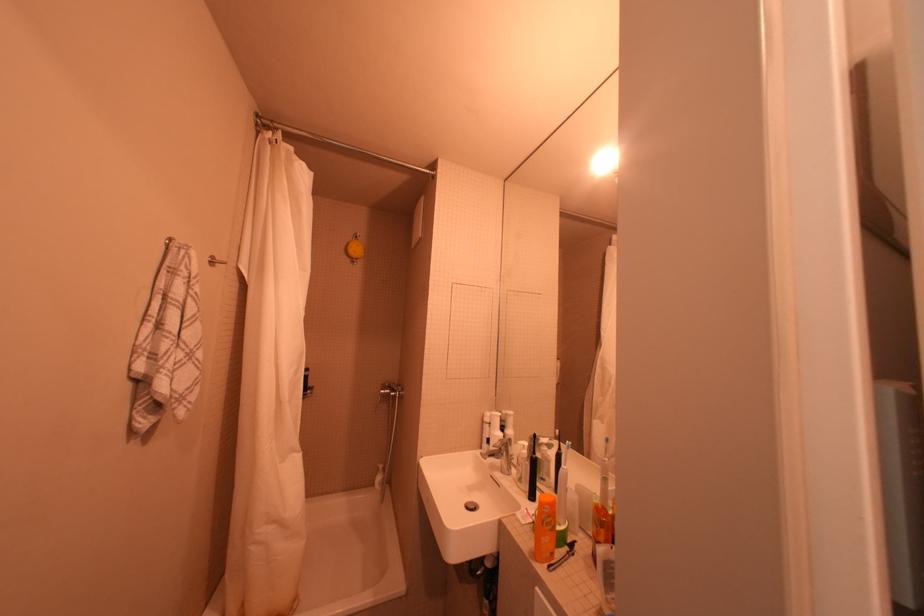
This screenshot has height=616, width=924. In order to click on sink faucet handle in this screenshot , I will do `click(500, 454)`.